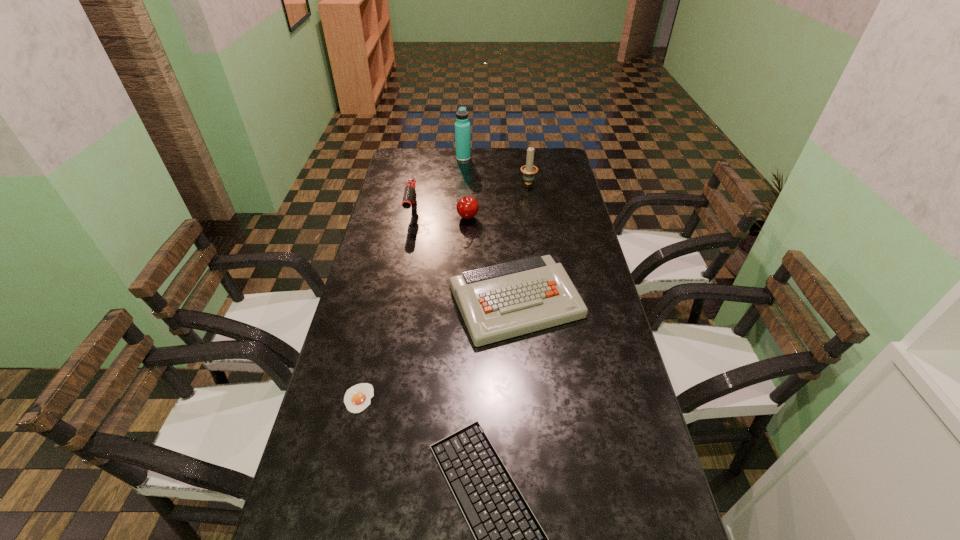
Locate an element on the screen. The image size is (960, 540). blank area located 0.200m on the left of the tallest object is located at coordinates (412, 158).

You are a GUI agent. You are given a task and a screenshot of the screen. Output one action in this format:
    pyautogui.click(x=<x>, y=<y>)
    Task: Click on the vacant space situated on the handle side of the sixth nearest object
    
    Given the screenshot: What is the action you would take?
    pyautogui.click(x=526, y=170)

This screenshot has width=960, height=540. Find the location of `vacant area situated 0.170m on the handle side of the sixth nearest object`. vacant area situated 0.170m on the handle side of the sixth nearest object is located at coordinates (524, 158).

Locate an element on the screen. The width and height of the screenshot is (960, 540). free space located 0.270m on the handle side of the sixth nearest object is located at coordinates (523, 147).

Locate an element on the screen. vacant point located at the aiming end of the gun is located at coordinates (402, 264).

The image size is (960, 540). What are the coordinates of `vacant space positioned on the front of the cherry` in the screenshot? It's located at (465, 301).

The width and height of the screenshot is (960, 540). Find the location of `free space located 0.170m on the left of the fifth farthest object`. free space located 0.170m on the left of the fifth farthest object is located at coordinates (394, 301).

Locate an element on the screen. vacant space located on the front of the egg yolk is located at coordinates (x=348, y=446).

Locate an element on the screen. The width and height of the screenshot is (960, 540). object present at the far edge is located at coordinates (462, 126).

Identify the location of gun present at the left edge. The image size is (960, 540). (409, 198).